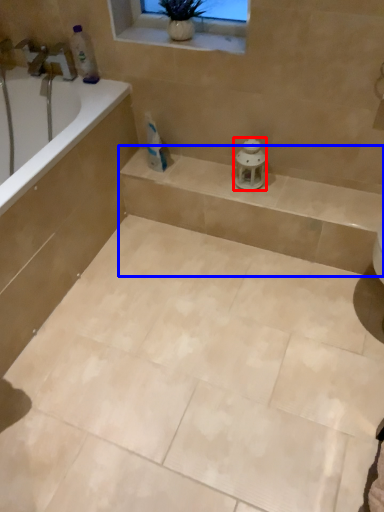
Question: Among these objects, which one is farthest to the camera, porcelain (highlighted by a red box) or balustrade (highlighted by a blue box)?

Choices:
 (A) porcelain
 (B) balustrade

Answer: (A)